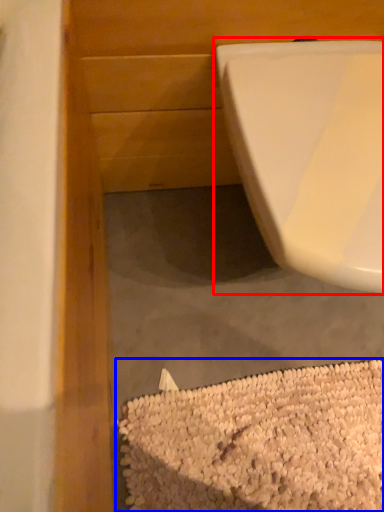
Question: Which object is closer to the camera taking this photo, toilet (highlighted by a red box) or debris (highlighted by a blue box)?

Choices:
 (A) toilet
 (B) debris

Answer: (A)